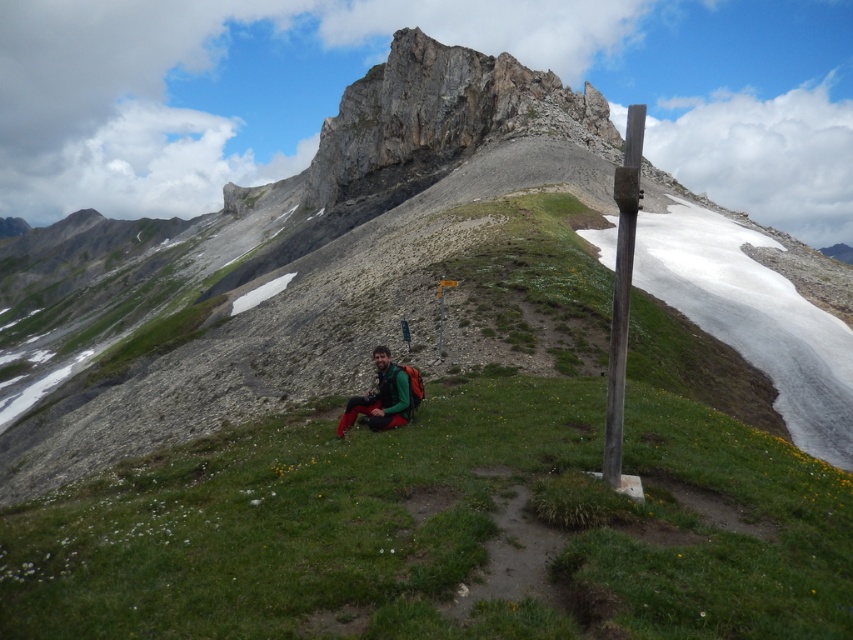
Does smooth wooden post at right appear on the right side of green matte jacket at center?

Indeed, smooth wooden post at right is positioned on the right side of green matte jacket at center.

Between point (612, 330) and point (386, 410), which one is positioned behind?

The point (386, 410) is behind.

At what (x,y) coordinates should I click in order to perform the action: click on smooth wooden post at right. Please return your answer as a coordinate pair (x, y). Image resolution: width=853 pixels, height=640 pixels. Looking at the image, I should click on pyautogui.click(x=621, y=289).